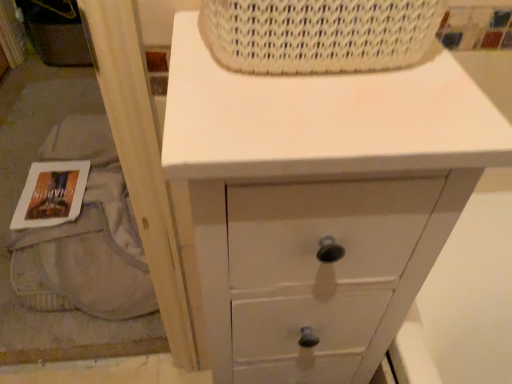
The width and height of the screenshot is (512, 384). What are the coordinates of `free space in front of white woven basket at upper center` in the screenshot? It's located at (325, 117).